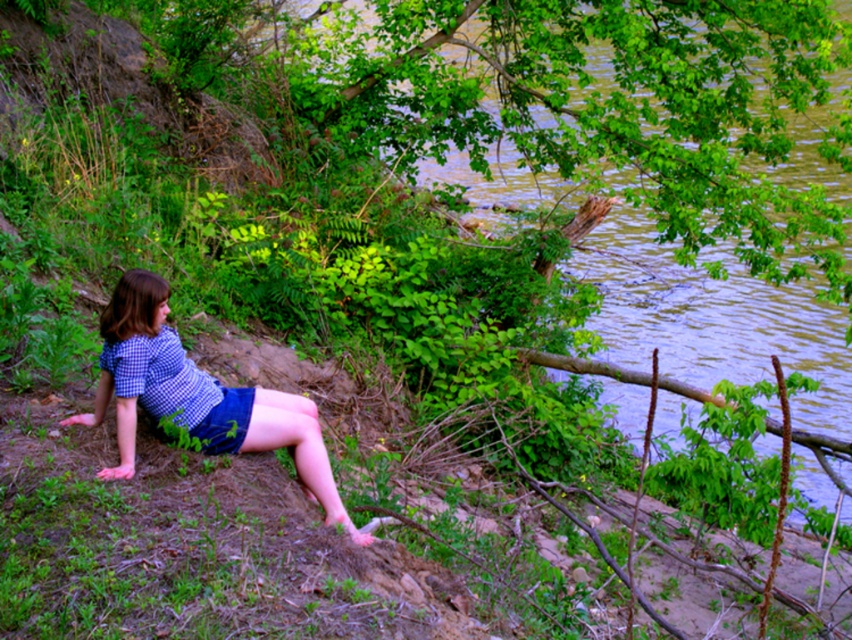
You are taking a photo of the scene and want to focus on both the point at coordinates point (153, 364) and point (213, 435). Which point should you focus on first to ensure both are in focus?

You should focus on point (153, 364) first because it is closer to the camera than point (213, 435), ensuring both will be in focus when using depth of field.

You are a photographer trying to capture the blue checkered shirt at center in your shot. Given that your camera has a focal length of 50mm and you are standing at point A, which is 3 meters away from the shirt, can you estimate the angle of view required to fully frame the shirt?

The blue checkered shirt at center is located at point coordinates, so you can calculate the angle of view using the formula for angle of view based on distance and focal length. The angle of view required would be approximately...